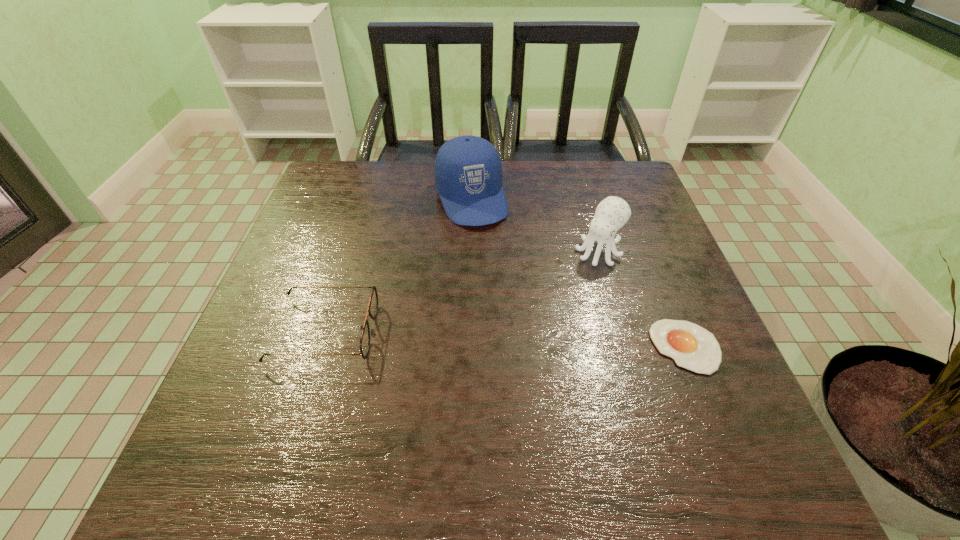
Find the location of a particular element. Image resolution: width=960 pixels, height=540 pixels. the second shortest object is located at coordinates (373, 303).

Locate an element on the screen. sunglasses is located at coordinates (373, 303).

This screenshot has width=960, height=540. I want to click on the shortest object, so click(692, 347).

This screenshot has width=960, height=540. Identify the location of the farthest object. (468, 173).

Where is `the second object from left to right`? the second object from left to right is located at coordinates (468, 173).

At what (x,y) coordinates should I click in order to perform the action: click on the third nearest object. Please return your answer as a coordinate pair (x, y). This screenshot has height=540, width=960. Looking at the image, I should click on (612, 213).

At what (x,y) coordinates should I click in order to perform the action: click on free space located 0.150m on the front-facing side of the leftmost object. Please return your answer as a coordinate pair (x, y). This screenshot has width=960, height=540. Looking at the image, I should click on (447, 332).

Locate an element on the screen. The width and height of the screenshot is (960, 540). vacant space located 0.350m on the left of the shortest object is located at coordinates (474, 347).

Where is `free region located on the front-facing side of the farthest object`? free region located on the front-facing side of the farthest object is located at coordinates (493, 257).

Image resolution: width=960 pixels, height=540 pixels. Identify the location of vacant point located 0.240m on the front-facing side of the farthest object. (510, 295).